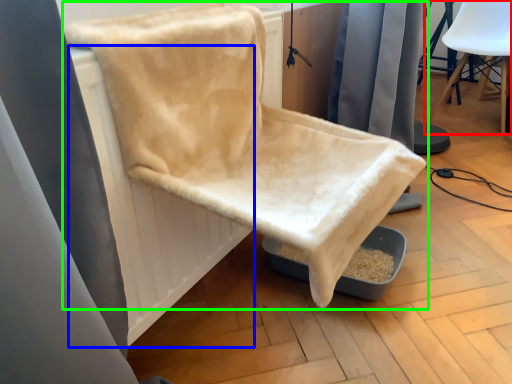
Question: Based on their relative distances, which object is nearer to chair (highlighted by a red box)? Choose from radiator (highlighted by a blue box) and chair (highlighted by a green box).

Choices:
 (A) radiator
 (B) chair

Answer: (B)